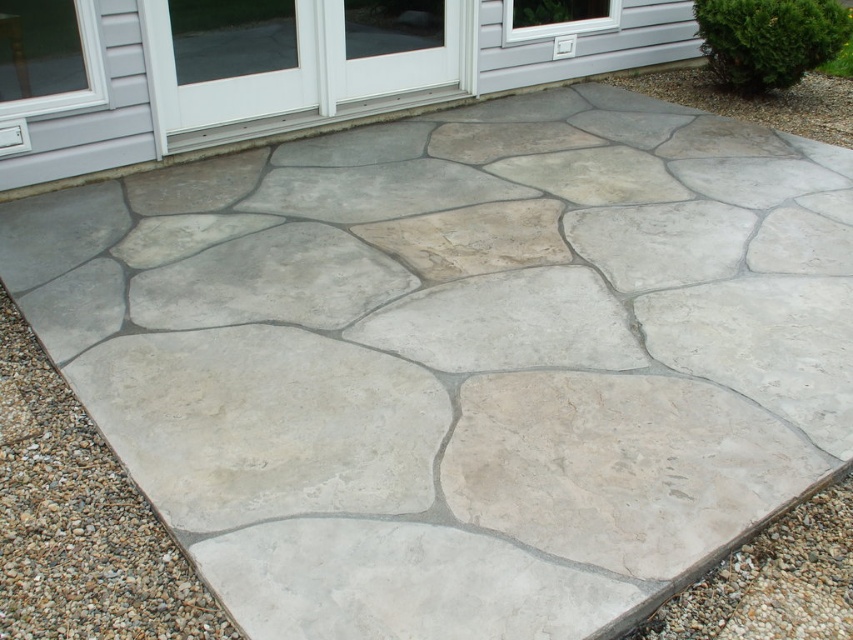
Question: Is gray gravel at lower left above gray gravel at bottom right?

Choices:
 (A) no
 (B) yes

Answer: (B)

Question: Among these points, which one is farthest from the camera?

Choices:
 (A) (737, 602)
 (B) (120, 531)

Answer: (B)

Question: Considering the relative positions of gray gravel at lower left and gray gravel at bottom right in the image provided, where is gray gravel at lower left located with respect to gray gravel at bottom right?

Choices:
 (A) left
 (B) right

Answer: (A)

Question: Among these objects, which one is farthest from the camera?

Choices:
 (A) gray gravel at bottom right
 (B) gray gravel at lower left

Answer: (A)

Question: Does gray gravel at lower left come in front of gray gravel at bottom right?

Choices:
 (A) no
 (B) yes

Answer: (B)